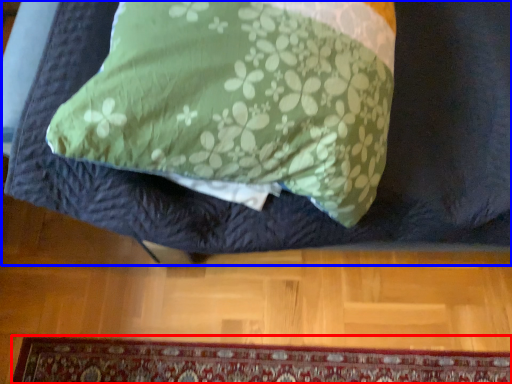
Question: Which object appears closest to the camera in this image, mat (highlighted by a red box) or furniture (highlighted by a blue box)?

Choices:
 (A) mat
 (B) furniture

Answer: (B)